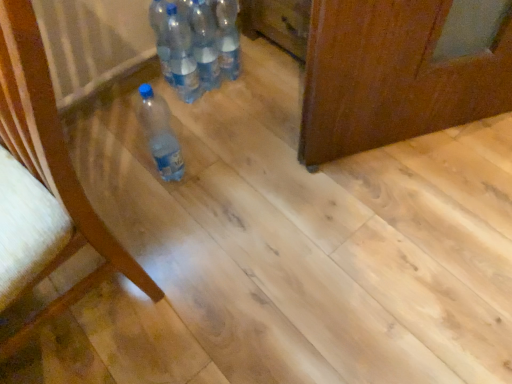
You are a GUI agent. You are given a task and a screenshot of the screen. Output one action in this format:
    pyautogui.click(x=<x>, y=<y>)
    Task: Click on the vacant location behind translucent plastic bottle at lower left, marked as the 1th bottle in a bottom-to-top arrangement
    The width and height of the screenshot is (512, 384).
    Given the screenshot: What is the action you would take?
    pyautogui.click(x=184, y=129)